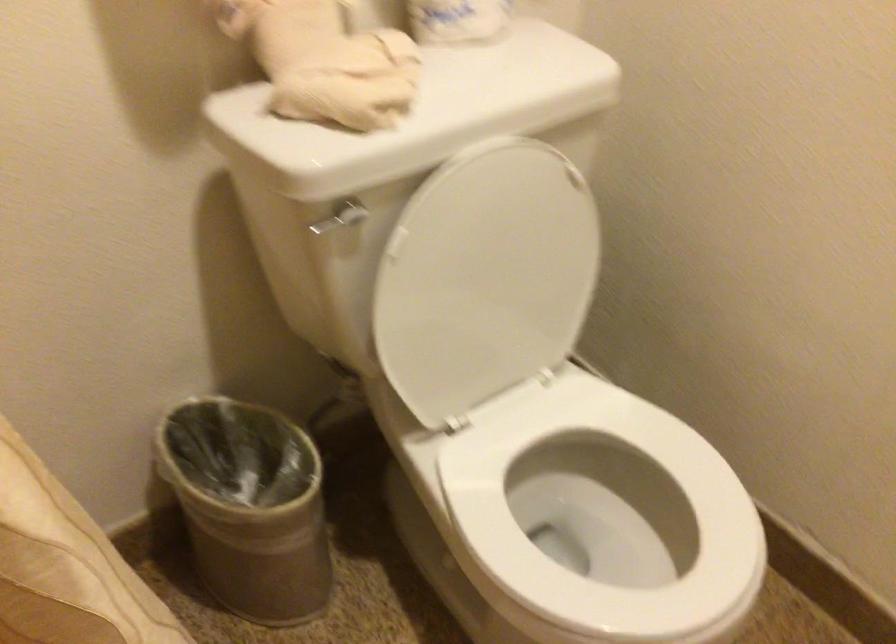
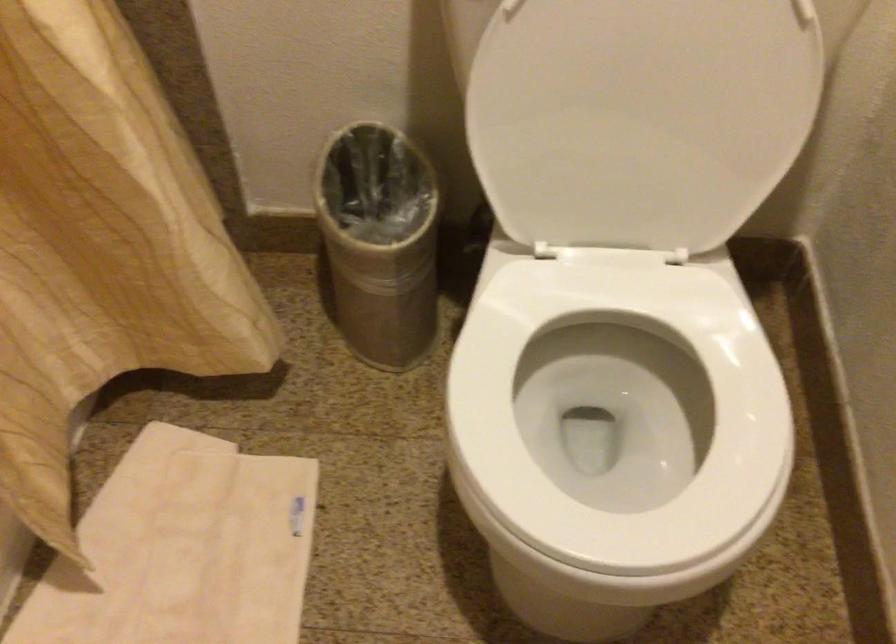
Looking at this image, based on the continuous images, in which direction is the camera rotating?

The rotation direction of the camera is left-down.